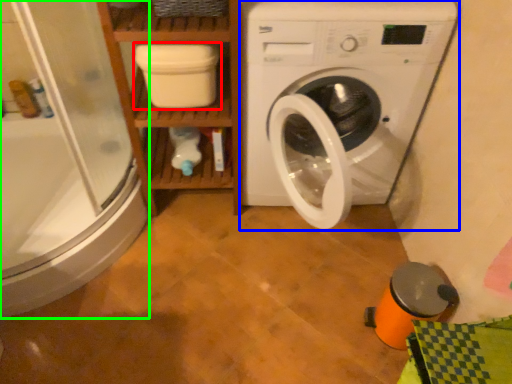
Question: Which is nearer to the dish washer (highlighted by a red box)? washing machine (highlighted by a blue box) or shower door (highlighted by a green box).

Choices:
 (A) washing machine
 (B) shower door

Answer: (A)